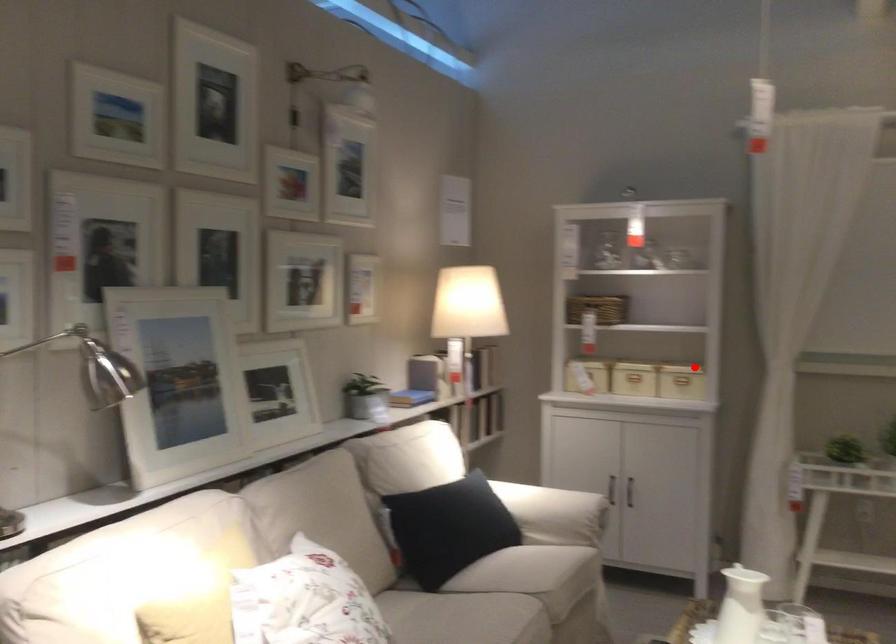
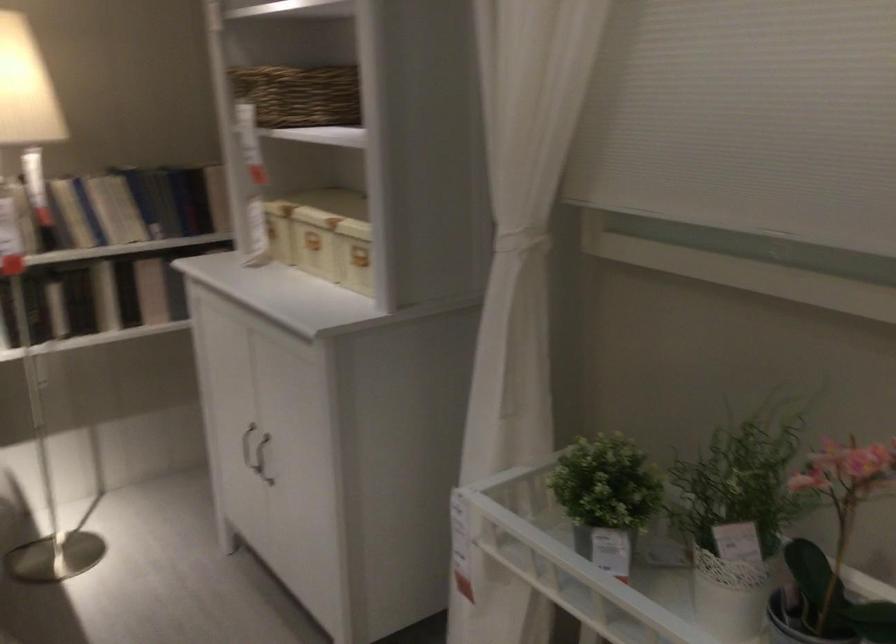
In the second image, find the point that corresponds to the highlighted location in the first image.

(354, 254)